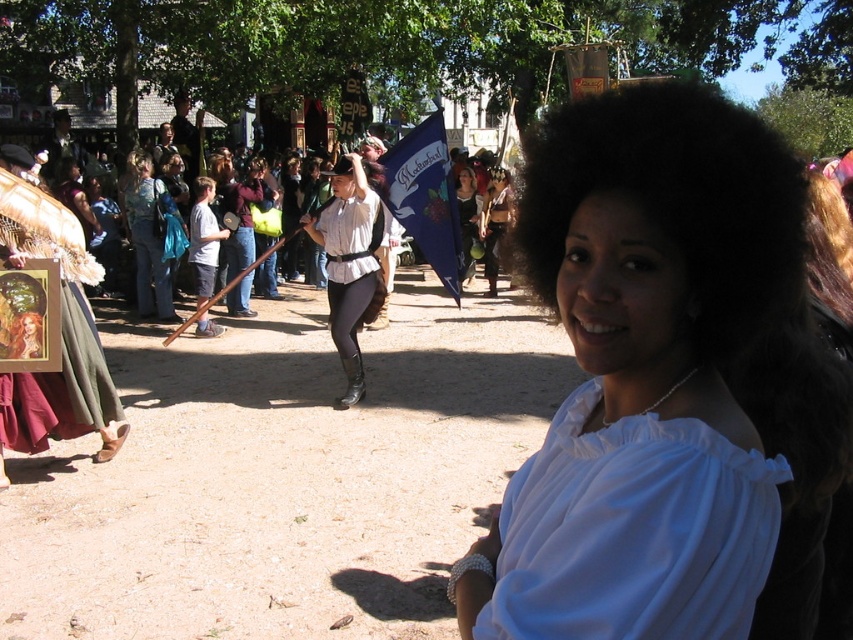
Does white satin dress at center have a smaller size compared to matte black dress at center?

Yes.

Who is shorter, white satin dress at center or matte black dress at center?

white satin dress at center is shorter.

Which is behind, point (570, 422) or point (463, 211)?

Positioned behind is point (463, 211).

Where is `white satin dress at center`? The image size is (853, 640). white satin dress at center is located at coordinates (631, 531).

Can you confirm if white satin dress at center is wider than blue fabric flag at center?

No, white satin dress at center is not wider than blue fabric flag at center.

Can you confirm if white satin dress at center is positioned to the left of blue fabric flag at center?

No, white satin dress at center is not to the left of blue fabric flag at center.

Identify the location of white satin dress at center. The image size is (853, 640). (631, 531).

Is blue fabric flag at center above matte black dress at center?

Actually, blue fabric flag at center is below matte black dress at center.

Which of these two, blue fabric flag at center or matte black dress at center, stands shorter?

matte black dress at center

Locate an element on the screen. The width and height of the screenshot is (853, 640). blue fabric flag at center is located at coordinates (425, 196).